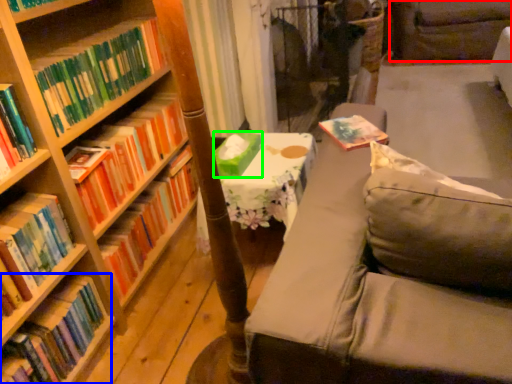
Question: Which object is the farthest from swivel chair (highlighted by a red box)? Choose among these: book (highlighted by a blue box) or paperback book (highlighted by a green box).

Choices:
 (A) book
 (B) paperback book

Answer: (A)